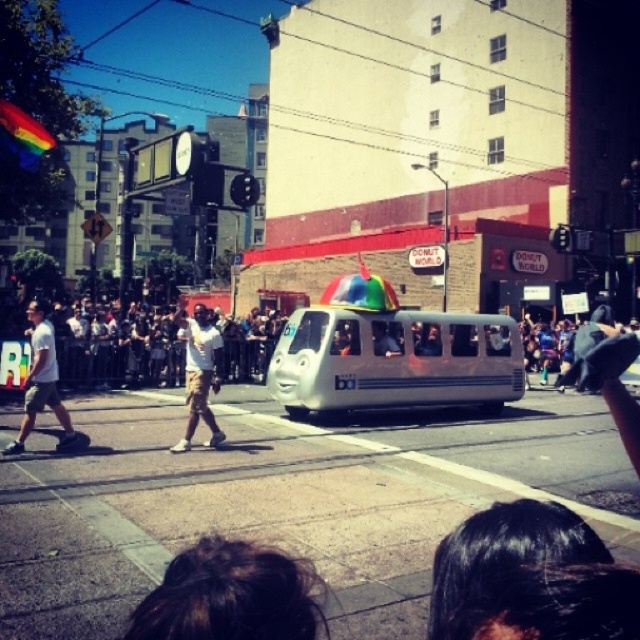
You are standing in the middle of the crowd at the parade. There is a black hair at upper center located at point [504,550]. Can you see the black hair at upper center from where you are standing?

Yes, the black hair at upper center is located at point 0.869, 0.789, so you can see it from your position in the crowd.